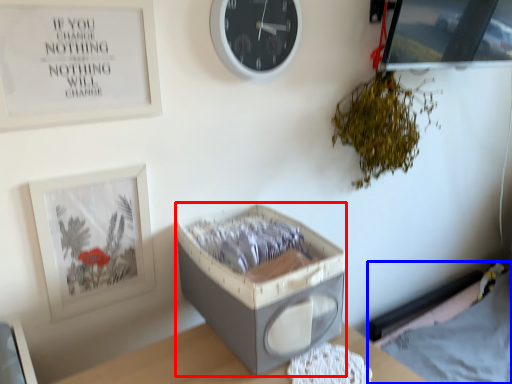
Question: Which of the following is the closest to the observer, storage box (highlighted by a red box) or hospital bed (highlighted by a blue box)?

Choices:
 (A) storage box
 (B) hospital bed

Answer: (A)